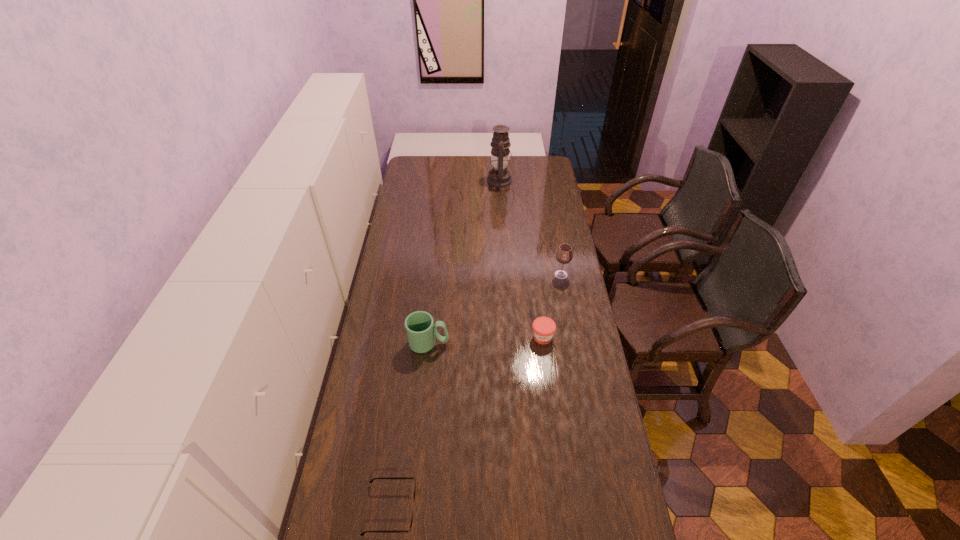
The image size is (960, 540). In order to click on free spot between the tallest object and the jam in this screenshot , I will do `click(521, 259)`.

At what (x,y) coordinates should I click in order to perform the action: click on vacant space that's between the second farthest object and the second object from right to left. Please return your answer as a coordinate pair (x, y). Looking at the image, I should click on (552, 306).

Locate an element on the screen. The width and height of the screenshot is (960, 540). free space between the mug and the spectacles is located at coordinates (410, 426).

Identify which object is located as the third nearest to the tallest object. Please provide its 2D coordinates. Your answer should be formatted as a tuple, i.e. [(x, y)], where the tuple contains the x and y coordinates of a point satisfying the conditions above.

[(421, 332)]

Where is `object that is the closest to the spectacles`? object that is the closest to the spectacles is located at coordinates 421,332.

Identify the location of free location that satisfies the following two spatial constraints: 1. on the front side of the oil lamp; 2. at the hinge ends of the shortest object. The height and width of the screenshot is (540, 960). (520, 509).

In order to click on free spot that satisfies the following two spatial constraints: 1. on the front label of the second object from right to left; 2. on the side of the third shortest object with the handle in this screenshot , I will do `click(543, 343)`.

In order to click on vacant space that satisfies the following two spatial constraints: 1. on the front side of the second farthest object; 2. on the right side of the third object from right to left in this screenshot , I will do `click(507, 275)`.